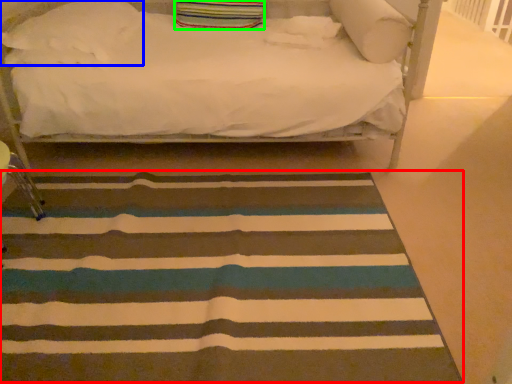
Question: Which object is positioned closest to mat (highlighted by a red box)? Select from pillow (highlighted by a blue box) and pillow (highlighted by a green box).

Choices:
 (A) pillow
 (B) pillow

Answer: (A)